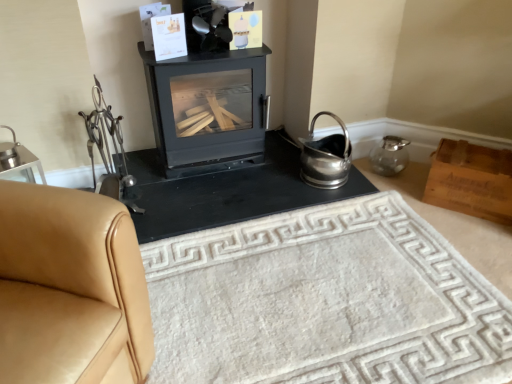
The width and height of the screenshot is (512, 384). What are the coordinates of `blank space situated above white textured rug at center (from a real-world perspective)` in the screenshot? It's located at (297, 291).